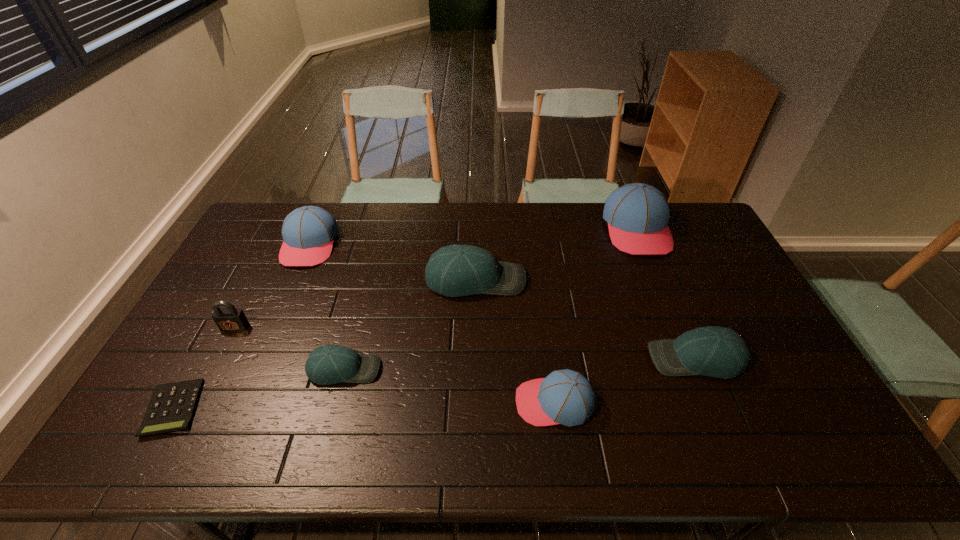
I want to click on the smallest blue baseball cap, so click(x=566, y=397).

Find the location of a particular element. the leftmost light baseball cap is located at coordinates (330, 364).

Locate an element on the screen. the shortest baseball cap is located at coordinates (330, 364).

You are a GUI agent. You are given a task and a screenshot of the screen. Output one action in this format:
    pyautogui.click(x=<x>, y=<y>)
    Task: Click on the calculator
    
    Given the screenshot: What is the action you would take?
    172,406

I want to click on vacant region located 0.110m on the front-facing side of the biggest blue baseball cap, so click(x=658, y=281).

Where is `free location located on the front-facing side of the second biggest blue baseball cap`? Image resolution: width=960 pixels, height=540 pixels. free location located on the front-facing side of the second biggest blue baseball cap is located at coordinates (292, 287).

The width and height of the screenshot is (960, 540). I want to click on vacant area situated 0.280m on the right of the biggest light baseball cap, so click(x=612, y=280).

Locate an element on the screen. vacant space located 0.330m on the front of the fifth nearest object near the keyhole is located at coordinates (176, 441).

I want to click on free space located on the right of the second biggest light baseball cap, so click(x=783, y=359).

The width and height of the screenshot is (960, 540). I want to click on blank space located on the front-facing side of the nearest blue baseball cap, so click(390, 402).